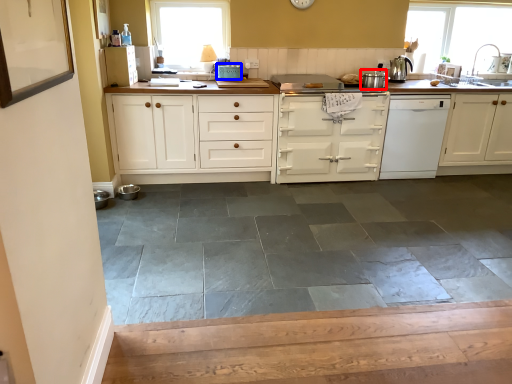
Question: Which of the following is the farthest to the observer, appliance (highlighted by a red box) or appliance (highlighted by a blue box)?

Choices:
 (A) appliance
 (B) appliance

Answer: (B)